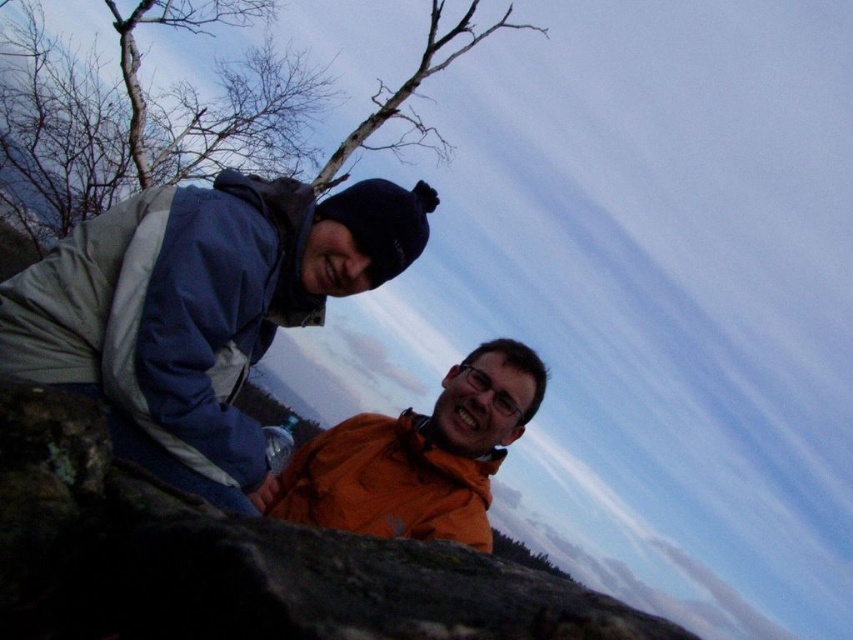
Which of these two, rough textured rock at lower center or orange matte jacket at center, stands taller?

Standing taller between the two is orange matte jacket at center.

Between point (42, 486) and point (509, 392), which one is positioned in front?

Positioned in front is point (42, 486).

Does point (299, 538) come behind point (440, 394)?

No.

Identify the location of rough textured rock at lower center. This screenshot has height=640, width=853. (236, 561).

Does blue/gray fleece jacket at left have a lesser width compared to bare branches at upper left?

Yes.

Does point (292, 314) come in front of point (376, 109)?

Yes.

Identify the location of blue/gray fleece jacket at left. (170, 310).

Between point (109, 486) and point (151, 125), which one is positioned behind?

Positioned behind is point (151, 125).

You are a GUI agent. You are given a task and a screenshot of the screen. Output one action in this format:
    pyautogui.click(x=<x>, y=<y>)
    Task: Click on the rough textured rock at lower center
    
    Given the screenshot: What is the action you would take?
    pyautogui.click(x=236, y=561)